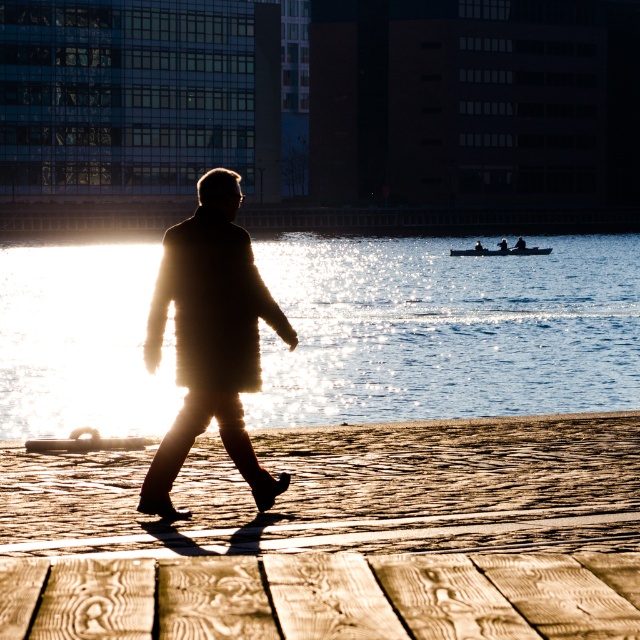
Consider the image. You are standing on the wooden planks at lower center and want to reach the smooth black boat at center. Which direction should you move to get closer to the boat?

Since the wooden planks at lower center occupies less space than smooth black boat at center, you should move forward along the walkway towards the center of the image to reach the boat.